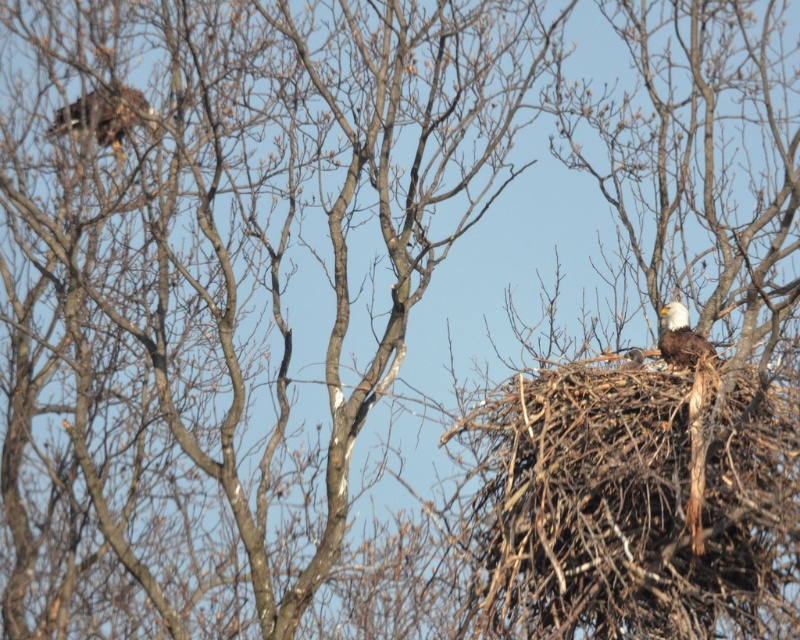
Question: Can you confirm if brown textured eagle at upper left is thinner than matte brown eagle at center?

Choices:
 (A) no
 (B) yes

Answer: (A)

Question: Which of the following is the closest to the observer?

Choices:
 (A) matte brown eagle at center
 (B) brown feathered eagle at upper right

Answer: (B)

Question: Which object appears closest to the camera in this image?

Choices:
 (A) brown textured eagle at upper left
 (B) matte brown eagle at center

Answer: (B)

Question: Among these objects, which one is farthest from the camera?

Choices:
 (A) brown feathered eagle at upper right
 (B) brown textured eagle at upper left

Answer: (B)

Question: Does brown textured eagle at upper left have a greater width compared to matte brown eagle at center?

Choices:
 (A) no
 (B) yes

Answer: (B)

Question: Does brown textured eagle at upper left have a lesser width compared to matte brown eagle at center?

Choices:
 (A) yes
 (B) no

Answer: (B)